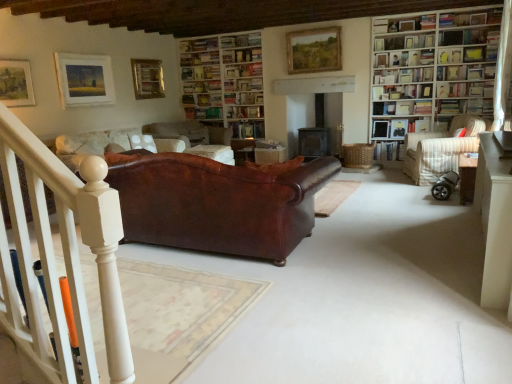
Question: Is white wooden bookcase at right, arranged as the 1th bookcase when viewed from the front, positioned with its back to hardcover book at upper right, the eighth book positioned from the left?

Choices:
 (A) no
 (B) yes

Answer: (B)

Question: Can you confirm if white wooden bookcase at right, the second bookcase from the back, is bigger than hardcover book at upper right, the eighth book positioned from the left?

Choices:
 (A) no
 (B) yes

Answer: (B)

Question: Considering the relative sizes of white wooden bookcase at right, arranged as the 1th bookcase when viewed from the front, and hardcover book at upper right, the eighth book positioned from the left, in the image provided, is white wooden bookcase at right, arranged as the 1th bookcase when viewed from the front, smaller than hardcover book at upper right, the eighth book positioned from the left,?

Choices:
 (A) yes
 (B) no

Answer: (B)

Question: Could hardcover book at upper right, the eighth book positioned from the left, be considered to be inside white wooden bookcase at right, arranged as the 1th bookcase when viewed from the front?

Choices:
 (A) no
 (B) yes

Answer: (B)

Question: Is white wooden bookcase at right, the second bookcase from the back, closer to the viewer compared to hardcover book at upper right, acting as the first book starting from the right?

Choices:
 (A) yes
 (B) no

Answer: (A)

Question: Is black rubber baby carriage at lower right spatially inside white paper bookshelf at upper right, placed as the fourth book when sorted from left to right, or outside of it?

Choices:
 (A) outside
 (B) inside

Answer: (A)

Question: In terms of height, does black rubber baby carriage at lower right look taller or shorter compared to white paper bookshelf at upper right, the 5th book positioned from the right?

Choices:
 (A) tall
 (B) short

Answer: (B)

Question: Is black rubber baby carriage at lower right in front of or behind white paper bookshelf at upper right, the 5th book positioned from the right, in the image?

Choices:
 (A) front
 (B) behind

Answer: (A)

Question: Looking at the image, does black rubber baby carriage at lower right seem bigger or smaller compared to white paper bookshelf at upper right, placed as the fourth book when sorted from left to right?

Choices:
 (A) big
 (B) small

Answer: (A)

Question: Is brown leather cushion at center bigger or smaller than hardcover book at center, the 2th book viewed from the left?

Choices:
 (A) small
 (B) big

Answer: (B)

Question: From a real-world perspective, is brown leather cushion at center positioned above or below hardcover book at center, the 2th book viewed from the left?

Choices:
 (A) above
 (B) below

Answer: (B)

Question: Considering the positions of brown leather cushion at center and hardcover book at center, the 2th book viewed from the left, in the image, is brown leather cushion at center taller or shorter than hardcover book at center, the 2th book viewed from the left,?

Choices:
 (A) short
 (B) tall

Answer: (B)

Question: From the image's perspective, is brown leather cushion at center located above or below hardcover book at center, which is counted as the seventh book, starting from the right?

Choices:
 (A) above
 (B) below

Answer: (B)

Question: In terms of width, does white paper bookshelf at upper right, the 5th book positioned from the right, look wider or thinner when compared to wooden bookshelf at upper right, acting as the fourth shelf starting from the bottom?

Choices:
 (A) wide
 (B) thin

Answer: (A)

Question: In the image, is white paper bookshelf at upper right, placed as the fourth book when sorted from left to right, positioned in front of or behind wooden bookshelf at upper right, acting as the 1th shelf starting from the top?

Choices:
 (A) behind
 (B) front

Answer: (A)